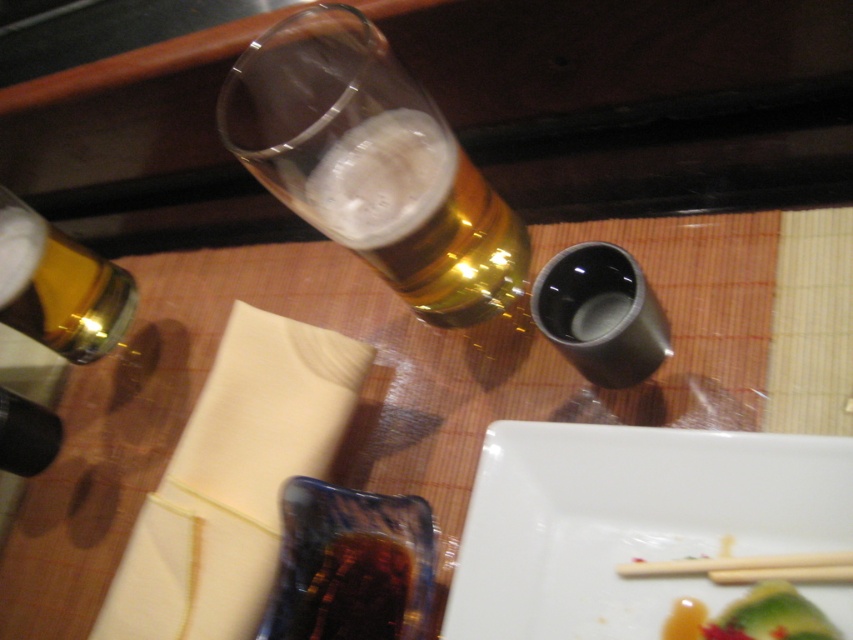
Is golden glass beer at upper center further to the viewer compared to gold metallic bottle at upper left?

No, golden glass beer at upper center is closer to the viewer.

Can you confirm if golden glass beer at upper center is smaller than gold metallic bottle at upper left?

Incorrect, golden glass beer at upper center is not smaller in size than gold metallic bottle at upper left.

Is point (345, 113) farther from camera compared to point (15, 218)?

No, (345, 113) is closer to viewer.

The height and width of the screenshot is (640, 853). Identify the location of golden glass beer at upper center. (372, 164).

Consider the image. Does white glossy plate at lower right appear on the left side of green leafy vegetable at lower right?

Correct, you'll find white glossy plate at lower right to the left of green leafy vegetable at lower right.

Is white glossy plate at lower right thinner than green leafy vegetable at lower right?

No.

Between point (662, 502) and point (782, 636), which one is positioned in front?

Point (782, 636) is more forward.

Locate an element on the screen. The width and height of the screenshot is (853, 640). white glossy plate at lower right is located at coordinates (630, 522).

Can you confirm if gold metallic bottle at upper left is positioned above green leafy vegetable at lower right?

Indeed, gold metallic bottle at upper left is positioned over green leafy vegetable at lower right.

Between gold metallic bottle at upper left and green leafy vegetable at lower right, which one is positioned higher?

gold metallic bottle at upper left is above.

Image resolution: width=853 pixels, height=640 pixels. What do you see at coordinates (61, 289) in the screenshot?
I see `gold metallic bottle at upper left` at bounding box center [61, 289].

At what (x,y) coordinates should I click in order to perform the action: click on gold metallic bottle at upper left. Please return your answer as a coordinate pair (x, y). Image resolution: width=853 pixels, height=640 pixels. Looking at the image, I should click on (x=61, y=289).